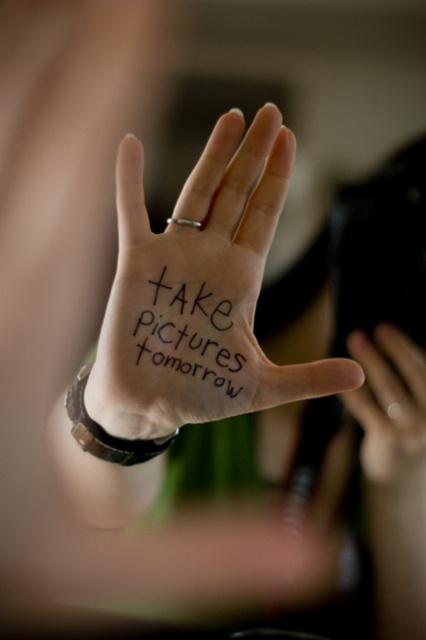
Question: Considering the real-world distances, which object is closest to the white smooth palm at center?

Choices:
 (A) smooth skin hand at center
 (B) black ink writing at center

Answer: (B)

Question: Does white smooth palm at center appear over smooth skin hand at center?

Choices:
 (A) yes
 (B) no

Answer: (A)

Question: Estimate the real-world distances between objects in this image. Which object is farther from the black ink writing at center?

Choices:
 (A) smooth skin hand at center
 (B) white smooth palm at center

Answer: (A)

Question: Is white smooth palm at center positioned in front of smooth skin hand at center?

Choices:
 (A) yes
 (B) no

Answer: (A)

Question: Is black ink writing at center thinner than smooth skin hand at center?

Choices:
 (A) no
 (B) yes

Answer: (B)

Question: Which point is farther to the camera?

Choices:
 (A) white smooth palm at center
 (B) smooth skin hand at center

Answer: (B)